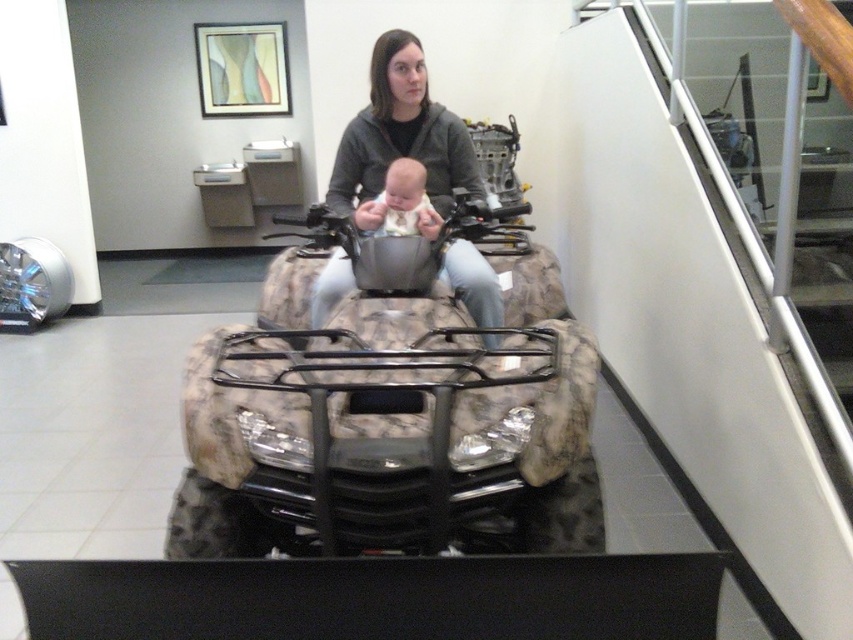
You are standing in the showroom and want to locate the matte gray hoodie at center. According to the coordinates provided, where exactly is it positioned?

The matte gray hoodie at center is located at point coordinates 0.217 on the x axis and 0.470 on the y axis.

You are a photographer setting up a shoot in the showroom. You need to ensure that both the matte gray hoodie at center and the soft white fabric baby at center are clearly visible in the photo. Based on their positions, which object should you focus on first to ensure both are in focus?

The matte gray hoodie at center is in front of the soft white fabric baby at center. To ensure both are in focus, you should focus on the matte gray hoodie at center first since it is closer to the camera, and the baby will be in the background but still within the depth of field if properly adjusted.

You are standing in front of the ATV in the showroom. There are two points marked in the image. One is at coordinates point [564,324] and the other is at point [386,198]. Which point is nearer to you?

Point [564,324] is closer to the camera than point [386,198], so the point at coordinates point [564,324] is nearer to you.